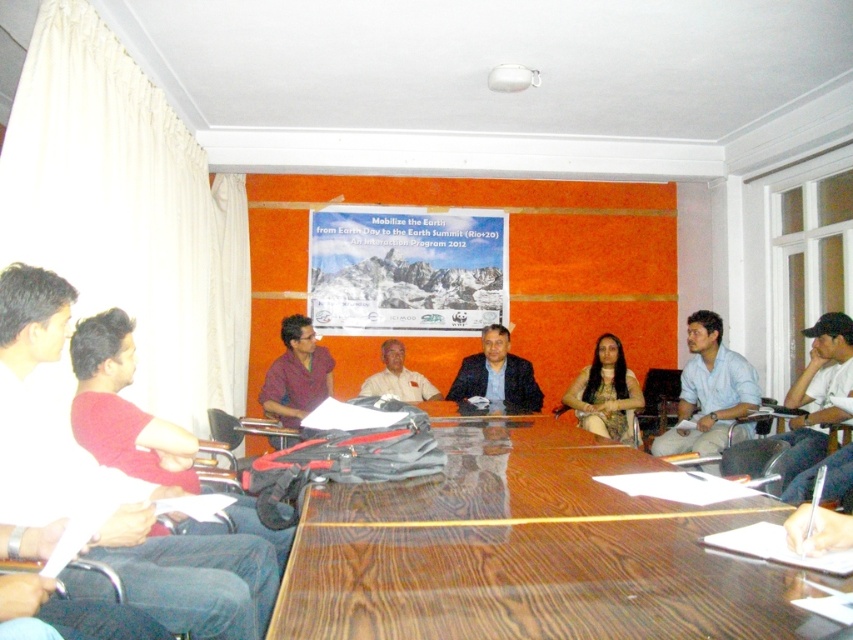
Question: Which point is closer to the camera?

Choices:
 (A) (9, 513)
 (B) (387, 340)

Answer: (A)

Question: Does light blue shirt at lower right have a lesser width compared to dark blue suit at center?

Choices:
 (A) no
 (B) yes

Answer: (A)

Question: Which point is farther from the camera taking this photo?

Choices:
 (A) click(9, 300)
 (B) click(329, 378)

Answer: (B)

Question: Which point is farther from the camera taking this photo?

Choices:
 (A) (413, 401)
 (B) (692, 433)
 (C) (534, 404)

Answer: (A)

Question: Observing the image, what is the correct spatial positioning of light blue shirt at lower right in reference to matte brown dress at center?

Choices:
 (A) right
 (B) left

Answer: (A)

Question: Is wooden at center bigger than purple matte shirt at center?

Choices:
 (A) no
 (B) yes

Answer: (A)